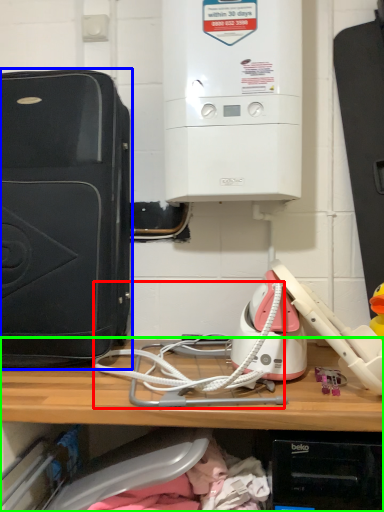
Question: Considering the real-world distances, which object is closest to wire (highlighted by a red box)? home appliance (highlighted by a blue box) or shelf (highlighted by a green box).

Choices:
 (A) home appliance
 (B) shelf

Answer: (B)